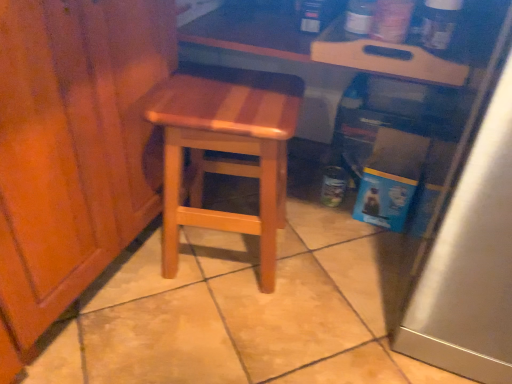
The width and height of the screenshot is (512, 384). In order to click on free point below natural wood stool at center (from a real-world perspective) in this screenshot , I will do `click(221, 256)`.